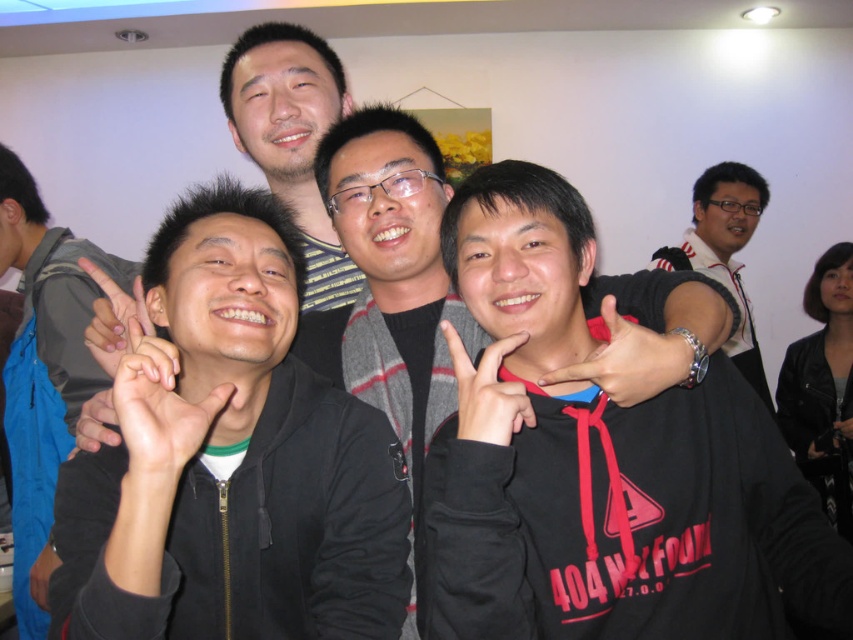
Locate an element on the screen. This screenshot has height=640, width=853. blue matte phone at center is located at coordinates (627, 360).

Is point (688, 323) farther from camera compared to point (85, 435)?

No.

Between point (663, 339) and point (96, 420), which one is positioned in front?

Point (663, 339) is more forward.

This screenshot has height=640, width=853. What are the coordinates of `blue matte phone at center` in the screenshot? It's located at (627, 360).

Does point (334, 360) come closer to viewer compared to point (122, 298)?

No, (334, 360) is behind (122, 298).

Which is in front, point (445, 179) or point (106, 360)?

Point (106, 360) is more forward.

Locate an element on the screen. black matte hoodie at center is located at coordinates (392, 272).

Does black matte hoodie at center appear on the right side of black matte jacket at left?

Yes, black matte hoodie at center is to the right of black matte jacket at left.

Between black matte hoodie at center and black matte jacket at left, which one has less height?

Standing shorter between the two is black matte hoodie at center.

Which is behind, point (410, 442) or point (20, 209)?

The point (20, 209) is more distant.

Identify the location of black matte hoodie at center. (392, 272).